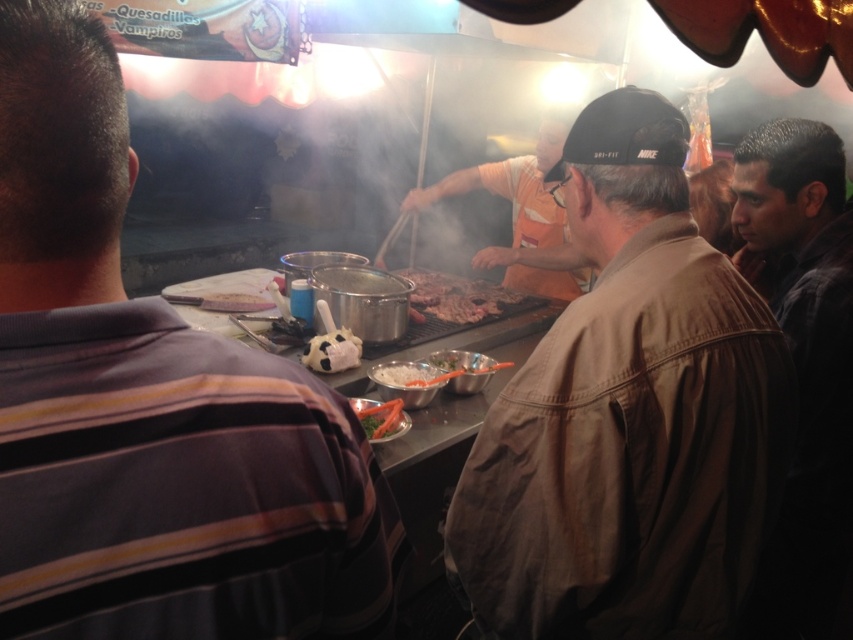
Question: Does brown cotton jacket at center have a greater width compared to white matte soccer ball at center?

Choices:
 (A) no
 (B) yes

Answer: (B)

Question: Can you confirm if striped cotton shirt at left is positioned above orange fabric shirt at center?

Choices:
 (A) no
 (B) yes

Answer: (A)

Question: Based on their relative distances, which object is nearer to the green leafy vegetable at center?

Choices:
 (A) white matte soccer ball at center
 (B) orange fabric shirt at center

Answer: (A)

Question: Is the position of striped cotton shirt at left more distant than that of grilled meat at center?

Choices:
 (A) yes
 (B) no

Answer: (B)

Question: Which object appears farthest from the camera in this image?

Choices:
 (A) dark brown leather jacket at right
 (B) brown cotton jacket at center
 (C) grilled meat at center
 (D) white matte soccer ball at center

Answer: (C)

Question: Which of these objects is positioned closest to the grilled meat at center?

Choices:
 (A) white matte soccer ball at center
 (B) striped cotton shirt at left

Answer: (A)